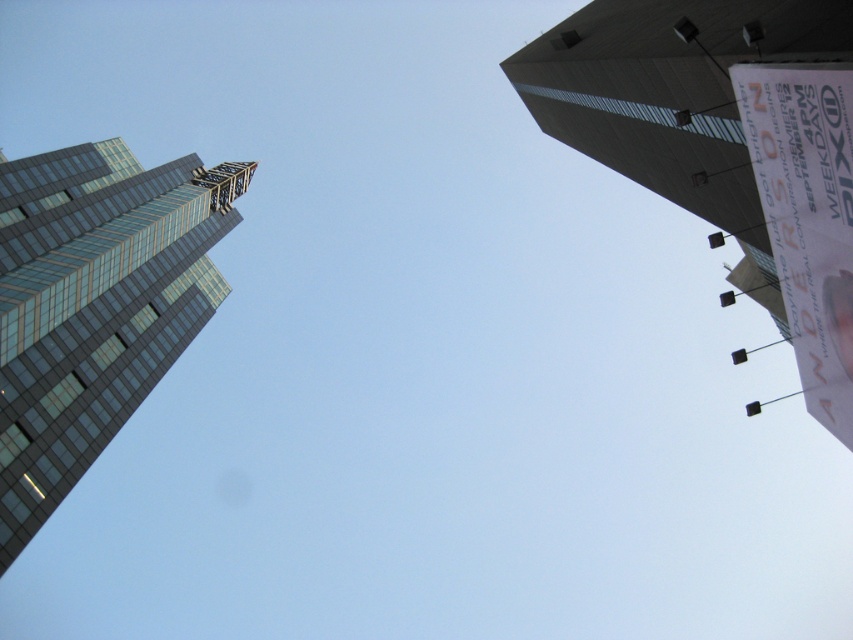
Based on the photo, you are an architect analyzing the two buildings in the image. Which building is shorter in height between the smooth concrete tower at upper right and the glassy steel skyscraper at left?

The smooth concrete tower at upper right is shorter in height compared to the glassy steel skyscraper at left.

You are standing at the base of the modern glass building on the left. Looking up, you notice a point marked at coordinates (726, 141). Which building does this point belong to?

The point at coordinates (726, 141) belongs to the smooth concrete tower at upper right.

You are standing at the base of the smooth concrete tower at upper right. You want to throw a ball to your friend who is standing 20 meters away from you in the same direction. Will the ball reach your friend before hitting the tower?

The smooth concrete tower at upper right is 17.21 meters from viewer, so the ball will hit the tower before reaching your friend who is 20 meters away.